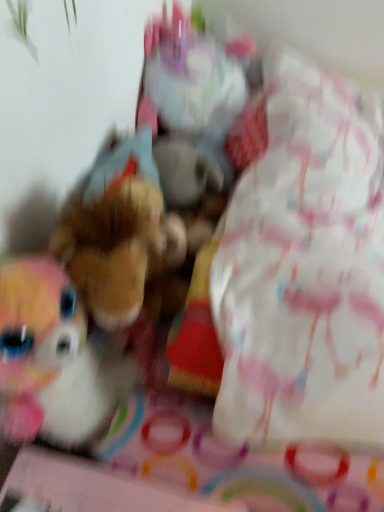
Question: Choose the correct answer: Is fluffy plush unicorn at upper center, which is counted as the first toy, starting from the top, inside brown plush toy at center, acting as the 2th toy starting from the top, or outside it?

Choices:
 (A) inside
 (B) outside

Answer: (B)

Question: Is point (175, 134) positioned closer to the camera than point (104, 304)?

Choices:
 (A) closer
 (B) farther

Answer: (B)

Question: From a real-world perspective, is fluffy plush unicorn at upper center, placed as the second toy when sorted from bottom to top, positioned above or below brown plush toy at center, which is the 1th toy in bottom-to-top order?

Choices:
 (A) above
 (B) below

Answer: (A)

Question: Is brown plush toy at center, which is the 1th toy in bottom-to-top order, taller or shorter than fluffy plush unicorn at upper center, which is counted as the first toy, starting from the top?

Choices:
 (A) short
 (B) tall

Answer: (A)

Question: Is point (160, 250) closer or farther from the camera than point (135, 114)?

Choices:
 (A) farther
 (B) closer

Answer: (B)

Question: From a real-world perspective, relative to fluffy plush unicorn at upper center, which is counted as the first toy, starting from the top, is brown plush toy at center, which is the 1th toy in bottom-to-top order, vertically above or below?

Choices:
 (A) above
 (B) below

Answer: (B)

Question: In terms of width, does brown plush toy at center, acting as the 2th toy starting from the top, look wider or thinner when compared to fluffy plush unicorn at upper center, which is counted as the first toy, starting from the top?

Choices:
 (A) thin
 (B) wide

Answer: (A)